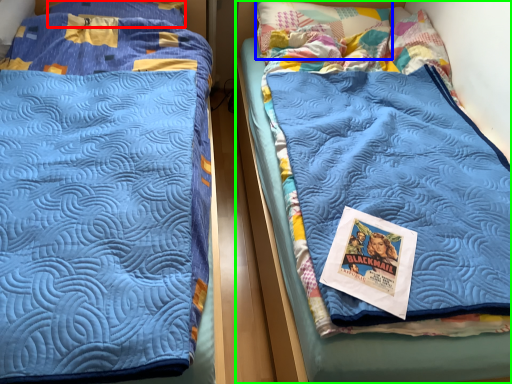
Question: Which is nearer to the pillow (highlighted by a red box)? pillow (highlighted by a blue box) or bed (highlighted by a green box).

Choices:
 (A) pillow
 (B) bed

Answer: (A)